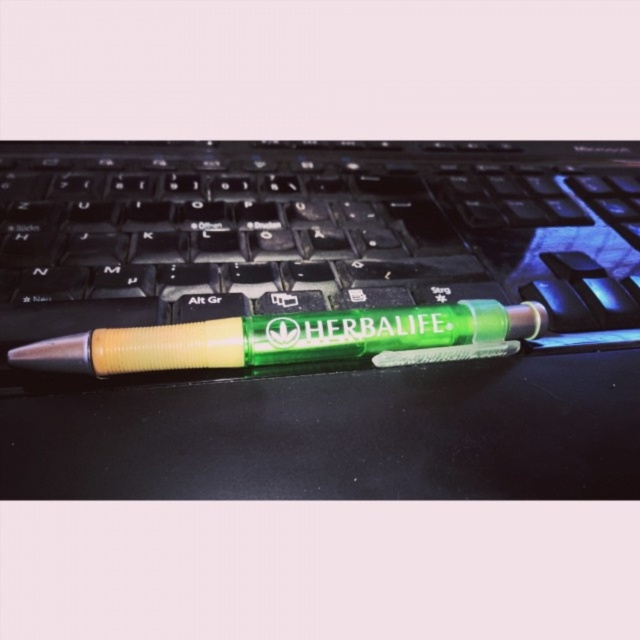
You have two pens on your desk, a transparent plastic pen at center and a translucent green pen at center. Which pen is wider?

The transparent plastic pen at center is wider than the translucent green pen at center.

You are trying to locate the transparent plastic pen at center on a black computer keyboard. What are the coordinates where you should look?

The transparent plastic pen at center is located at coordinates [310,230].

You are organizing a desk and need to place the transparent plastic pen at center and the translucent green pen at center into a pen holder. Which pen should you place first to ensure both fit properly?

The transparent plastic pen at center is positioned over the translucent green pen at center, so you should place the translucent green pen at center first to make space for the transparent plastic pen at center on top.